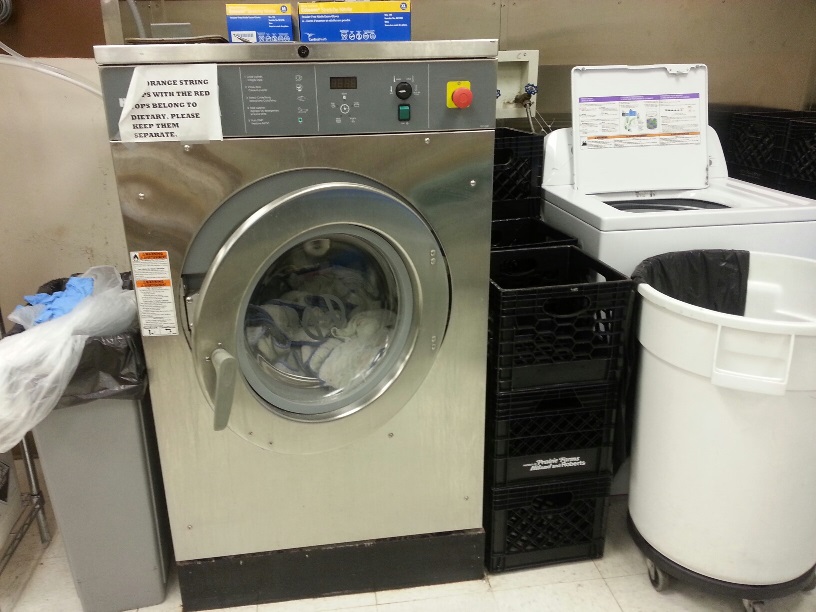
Find the location of `drying machine`. drying machine is located at coordinates (410, 461).